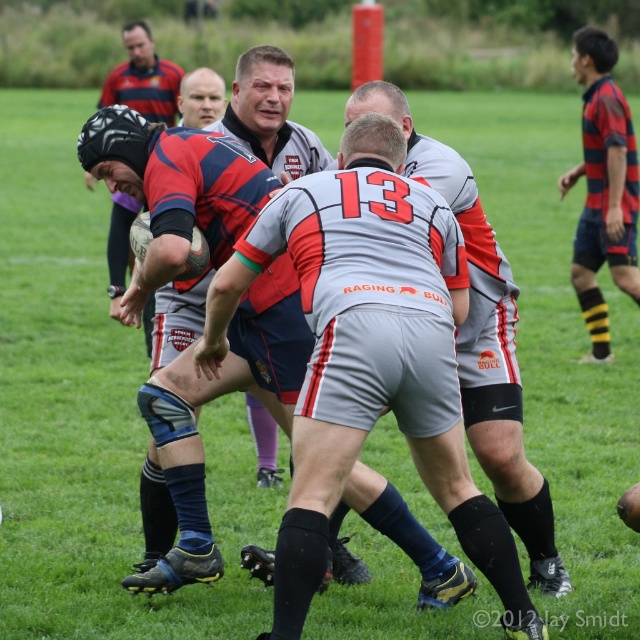
Question: Does matte gray shorts at center come behind gray matte shorts at center?

Choices:
 (A) no
 (B) yes

Answer: (A)

Question: Is the position of gray matte shorts at center more distant than that of striped jersey at center?

Choices:
 (A) no
 (B) yes

Answer: (A)

Question: Among these points, which one is farthest from the camera?

Choices:
 (A) (634, 154)
 (B) (337, 385)

Answer: (A)

Question: Is gray matte shorts at center wider than striped jersey at center?

Choices:
 (A) yes
 (B) no

Answer: (A)

Question: Which point appears farthest from the camera in this image?

Choices:
 (A) (317, 332)
 (B) (493, 298)

Answer: (B)

Question: Which object appears closest to the camera in this image?

Choices:
 (A) matte gray shorts at center
 (B) striped jersey at center

Answer: (A)